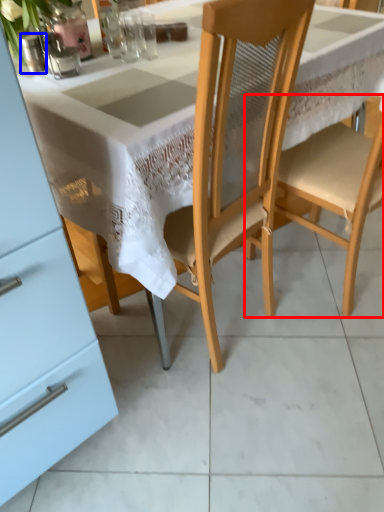
Question: Which object is closer to the camera taking this photo, chair (highlighted by a red box) or tableware (highlighted by a blue box)?

Choices:
 (A) chair
 (B) tableware

Answer: (A)